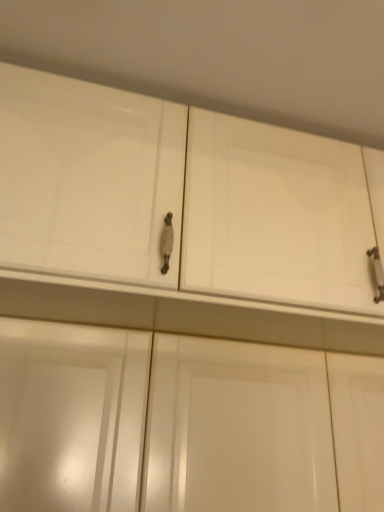
What is the approximate height of glossy white cabinet at lower center?

glossy white cabinet at lower center is 36.53 centimeters tall.

Describe the element at coordinates (184, 423) in the screenshot. I see `glossy white cabinet at lower center` at that location.

Locate an element on the screen. glossy white cabinet at lower center is located at coordinates (184, 423).

Locate an element on the screen. glossy white cabinet at lower center is located at coordinates (184, 423).